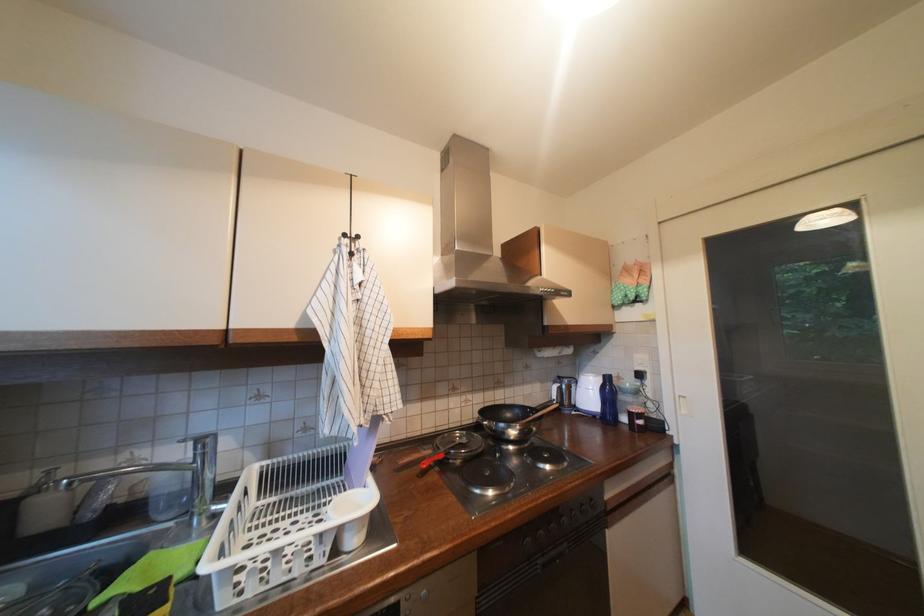
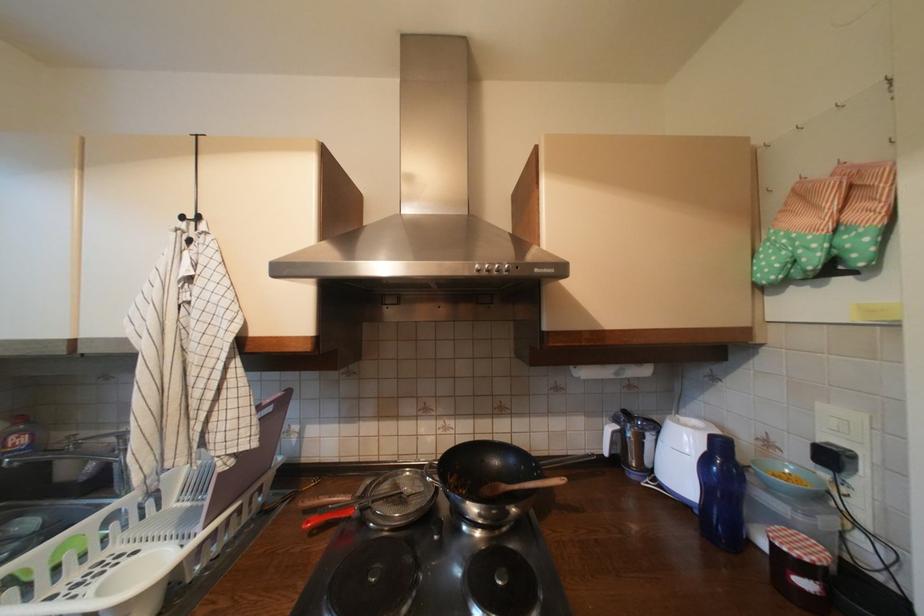
Find the pixel in the second image that matches (x=606, y=418) in the first image.

(704, 513)